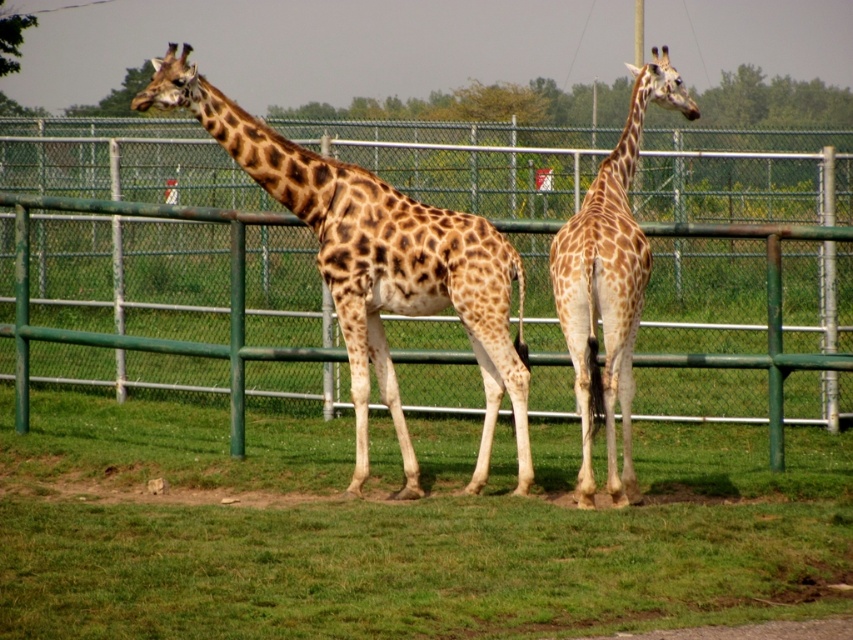
You are a zookeeper who needs to place a new feeding station in the enclosure. The feeding station must be placed at the exact 2D coordinates where the green grass at lower center is located. What are the coordinates for placing the feeding station?

The coordinates for placing the feeding station are at point (399,529) where the green grass at lower center is located.

You are a zookeeper trying to feed both spotted fur giraffe at left and spotted fur giraffe at center. Since you can only reach one at a time, which giraffe should you approach first to ensure you can reach both without moving your position?

The spotted fur giraffe at left is positioned over the spotted fur giraffe at center, so you should approach the spotted fur giraffe at center first before the one at left to ensure you can reach both without moving your position.